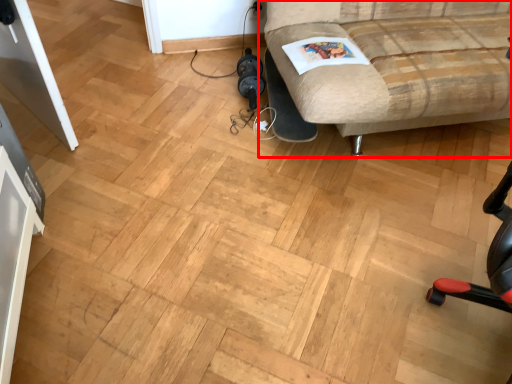
Question: From the image's perspective, what is the correct spatial relationship of studio couch (annotated by the red box) in relation to magazine?

Choices:
 (A) above
 (B) below

Answer: (A)